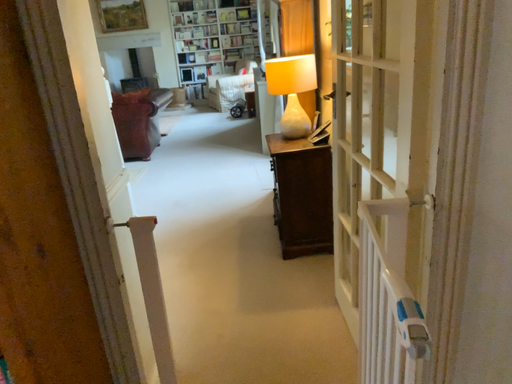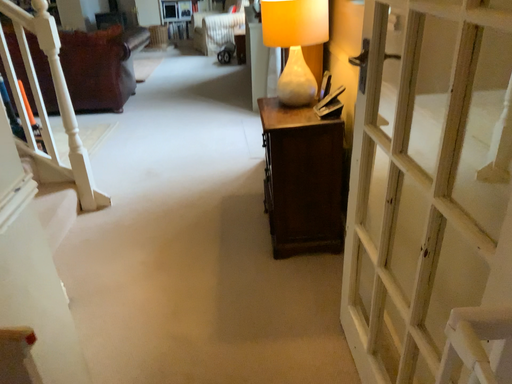
Question: How did the camera likely rotate when shooting the video?

Choices:
 (A) rotated downward
 (B) rotated upward

Answer: (A)